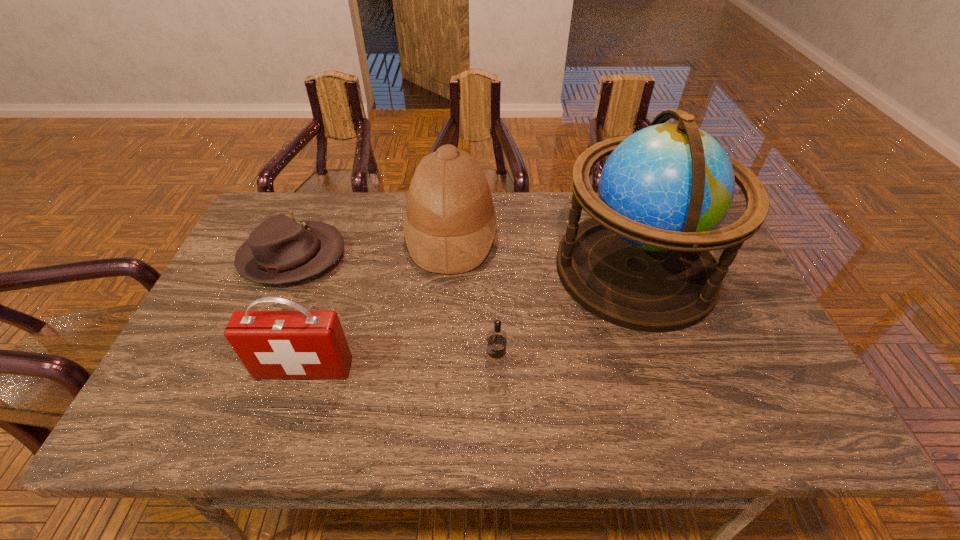
In order to click on free location at the left edge in this screenshot , I will do `click(244, 301)`.

In the image, there is a desktop. Identify the location of vacant space at the far left corner. This screenshot has width=960, height=540. (306, 205).

Identify the location of free spot between the vodka and the right hat. The image size is (960, 540). (473, 300).

This screenshot has height=540, width=960. Identify the location of free space between the vodka and the taller hat. (473, 300).

Where is `free spot between the first-aid kit and the globe`? This screenshot has width=960, height=540. free spot between the first-aid kit and the globe is located at coordinates (469, 319).

What are the coordinates of `free space between the right hat and the rightmost object` in the screenshot? It's located at (543, 252).

This screenshot has width=960, height=540. Find the location of `empty location between the taller hat and the left hat`. empty location between the taller hat and the left hat is located at coordinates (372, 246).

You are a GUI agent. You are given a task and a screenshot of the screen. Output one action in this format:
    pyautogui.click(x=<x>, y=<y>)
    Task: Click on the free point between the third shortest object and the taller hat
    
    Given the screenshot: What is the action you would take?
    pyautogui.click(x=377, y=301)

Where is `vacant region between the taller hat and the left hat`? This screenshot has width=960, height=540. vacant region between the taller hat and the left hat is located at coordinates (372, 246).

Find the location of a particular element. Image resolution: width=960 pixels, height=540 pixels. vacant space in between the taller hat and the vodka is located at coordinates (473, 300).